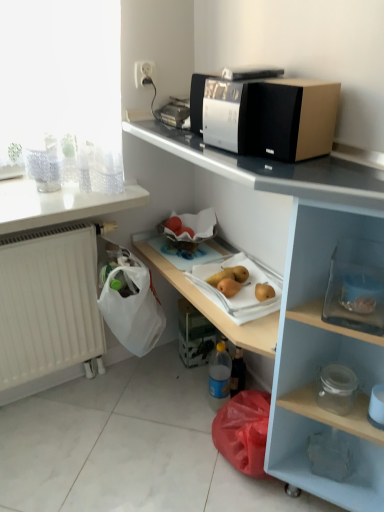
Locate an element on the screen. Image resolution: width=384 pixels, height=512 pixels. vacant area located to the right-hand side of white matte radiator at lower left is located at coordinates (144, 401).